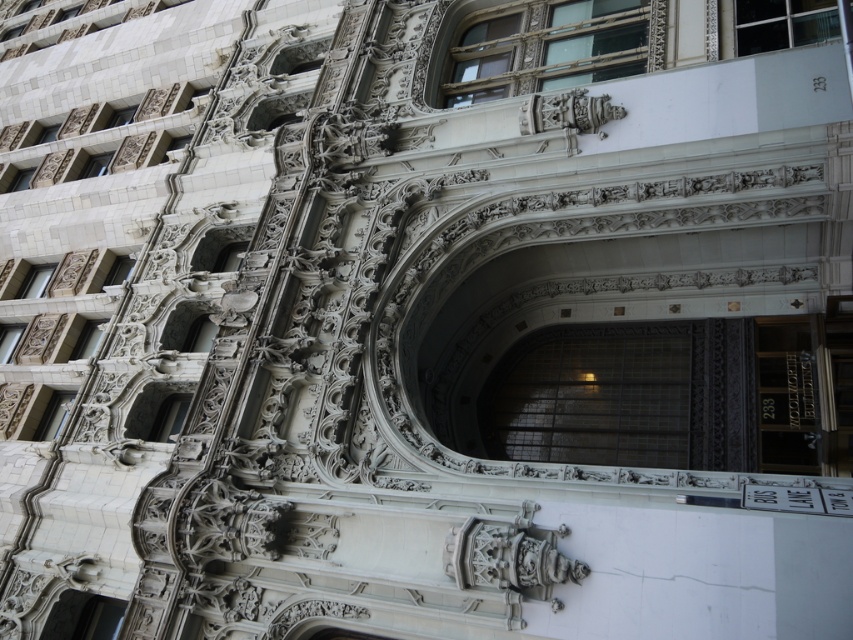
Can you confirm if black glass door at center is smaller than matte glass door at lower left?

Actually, black glass door at center might be larger than matte glass door at lower left.

Between point (795, 433) and point (108, 620), which one is positioned behind?

The point (795, 433) is more distant.

Between point (810, 355) and point (71, 628), which one is positioned behind?

Positioned behind is point (810, 355).

Find the location of `black glass door at center`. black glass door at center is located at coordinates (786, 396).